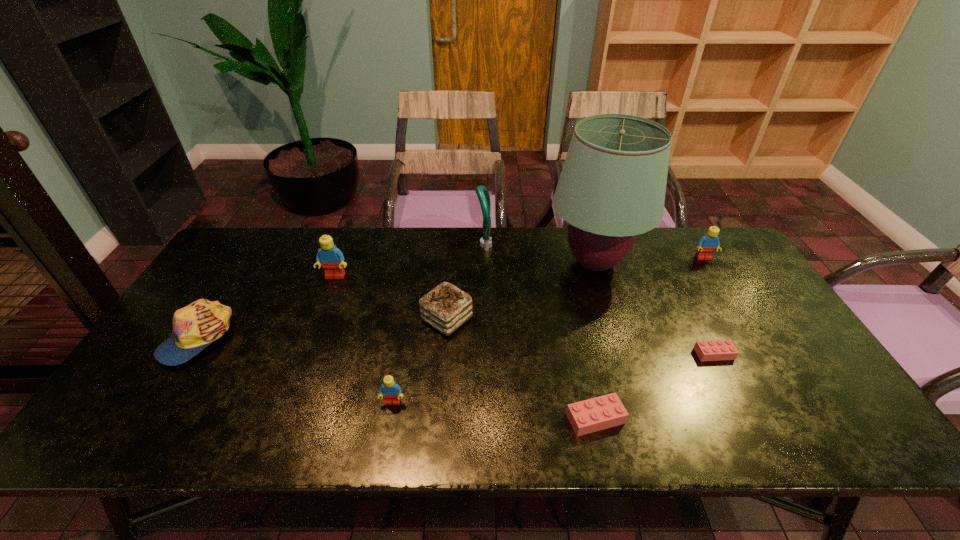
You are a GUI agent. You are given a task and a screenshot of the screen. Output one action in this format:
    pyautogui.click(x=<x>, y=<y>)
    Task: Click on the vacant space located 0.380m on the face of the second nearest blue Lego
    The image size is (960, 540).
    Given the screenshot: What is the action you would take?
    pyautogui.click(x=294, y=385)

Locate an element on the screen. vacant space located 0.110m on the face of the farthest blue Lego is located at coordinates [719, 284].

Locate an element on the screen. The width and height of the screenshot is (960, 540). vacant area situated on the right of the fourth object from left to right is located at coordinates [x=519, y=319].

Locate an element on the screen. This screenshot has height=540, width=960. free space located 0.090m on the bill of the cap is located at coordinates (156, 401).

Find the location of a particular element. The width and height of the screenshot is (960, 540). vacant space located 0.200m on the left of the left pink Lego is located at coordinates [x=478, y=418].

Identify the location of vacant region located 0.100m on the left of the shortest object. (658, 354).

What are the coordinates of `lampshade that is at the far edge` in the screenshot? It's located at (612, 186).

Image resolution: width=960 pixels, height=540 pixels. I want to click on bottle opener present at the far edge, so click(x=482, y=192).

Where is `object present at the near edge`? The height and width of the screenshot is (540, 960). object present at the near edge is located at coordinates (599, 413).

What are the coordinates of `object located at the left edge` in the screenshot? It's located at (196, 326).